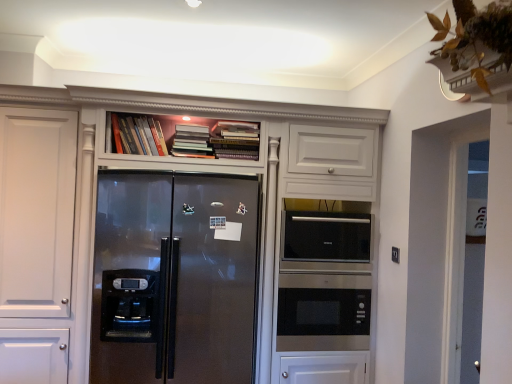
Question: Considering the relative positions of hardcover books at upper center, marked as the 3th book in a right-to-left arrangement, and sleek stainless steel microwave at center in the image provided, is hardcover books at upper center, marked as the 3th book in a right-to-left arrangement, to the right of sleek stainless steel microwave at center from the viewer's perspective?

Choices:
 (A) no
 (B) yes

Answer: (A)

Question: Considering the relative sizes of hardcover books at upper center, the first book viewed from the left, and sleek stainless steel microwave at center in the image provided, is hardcover books at upper center, the first book viewed from the left, wider than sleek stainless steel microwave at center?

Choices:
 (A) no
 (B) yes

Answer: (A)

Question: Is hardcover books at upper center, the first book viewed from the left, oriented away from sleek stainless steel microwave at center?

Choices:
 (A) no
 (B) yes

Answer: (A)

Question: From the image's perspective, is hardcover books at upper center, the first book viewed from the left, located above sleek stainless steel microwave at center?

Choices:
 (A) yes
 (B) no

Answer: (A)

Question: Can you confirm if hardcover books at upper center, the first book viewed from the left, is positioned to the left of sleek stainless steel microwave at center?

Choices:
 (A) no
 (B) yes

Answer: (B)

Question: Considering the relative sizes of hardcover books at upper center, the first book viewed from the left, and sleek stainless steel microwave at center in the image provided, is hardcover books at upper center, the first book viewed from the left, shorter than sleek stainless steel microwave at center?

Choices:
 (A) yes
 (B) no

Answer: (A)

Question: Is sleek stainless steel microwave at center located within hardcover books at upper center, arranged as the second book when viewed from the left?

Choices:
 (A) no
 (B) yes

Answer: (A)

Question: Considering the relative positions of hardcover books at upper center, arranged as the second book when viewed from the left, and sleek stainless steel microwave at center in the image provided, is hardcover books at upper center, arranged as the second book when viewed from the left, to the right of sleek stainless steel microwave at center from the viewer's perspective?

Choices:
 (A) yes
 (B) no

Answer: (B)

Question: From a real-world perspective, is hardcover books at upper center, arranged as the second book when viewed from the left, beneath sleek stainless steel microwave at center?

Choices:
 (A) no
 (B) yes

Answer: (A)

Question: Can you confirm if hardcover books at upper center, which is the 2th book in right-to-left order, is thinner than sleek stainless steel microwave at center?

Choices:
 (A) yes
 (B) no

Answer: (B)

Question: From the image's perspective, does hardcover books at upper center, arranged as the second book when viewed from the left, appear higher than sleek stainless steel microwave at center?

Choices:
 (A) yes
 (B) no

Answer: (A)

Question: Is hardcover books at upper center, arranged as the second book when viewed from the left, oriented away from sleek stainless steel microwave at center?

Choices:
 (A) yes
 (B) no

Answer: (B)

Question: Is stainless steel microwave at center taller than hardcover books at upper center, marked as the 3th book in a right-to-left arrangement?

Choices:
 (A) no
 (B) yes

Answer: (B)